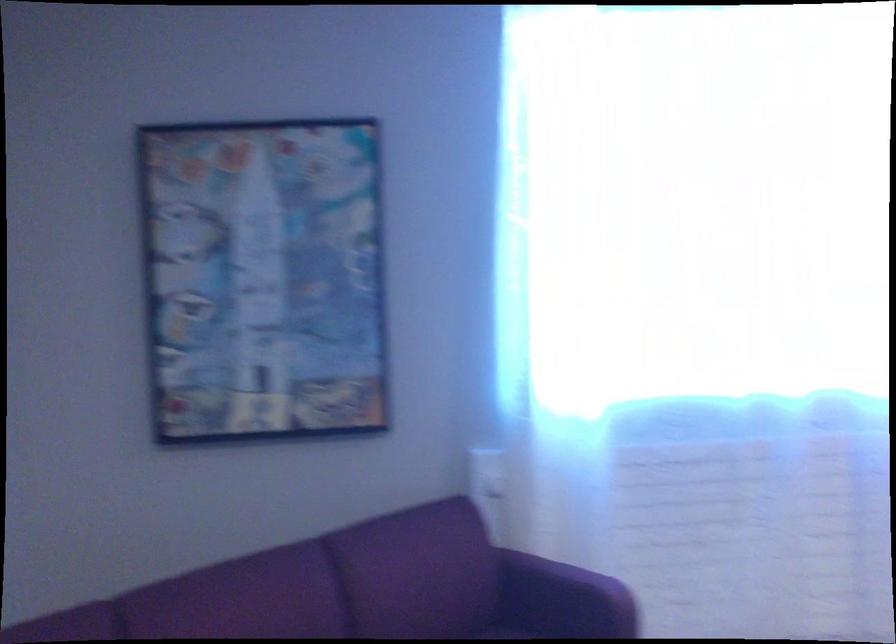
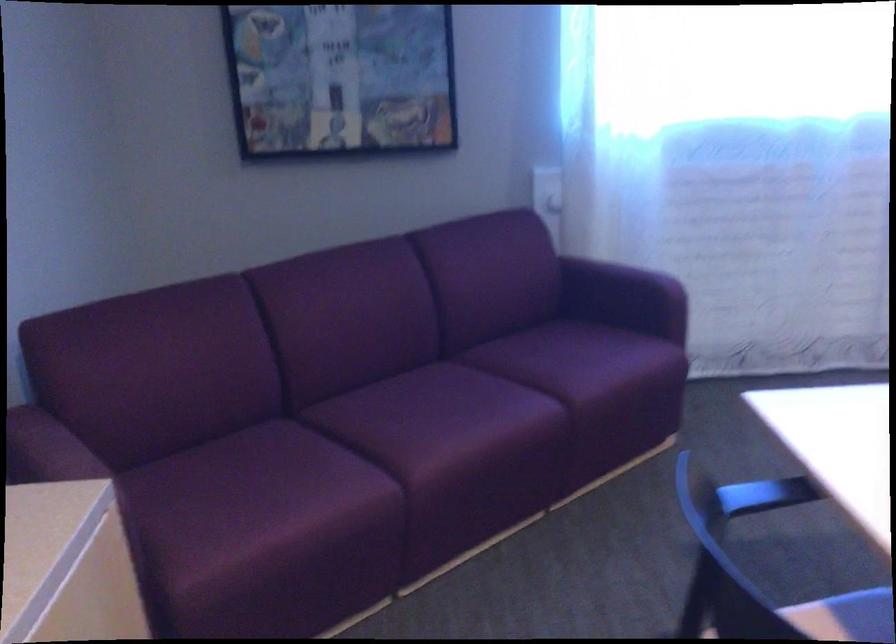
Find the pixel in the second image that matches (x=487, y=478) in the first image.

(547, 191)